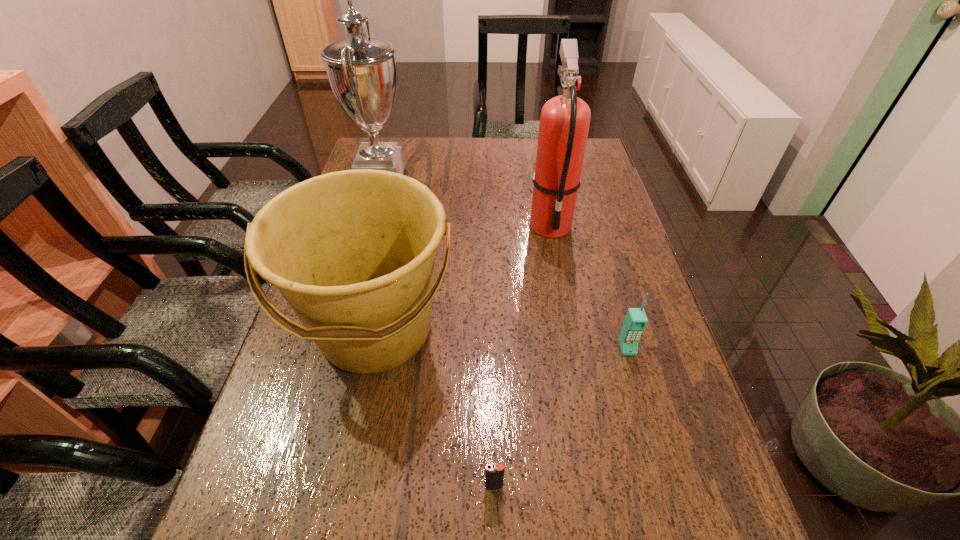
Where is `trophy cup`? Image resolution: width=960 pixels, height=540 pixels. trophy cup is located at coordinates (361, 70).

What are the coordinates of `fire extinguisher` in the screenshot? It's located at (564, 124).

Locate an element on the screen. the third shortest object is located at coordinates (353, 252).

You are a GUI agent. You are given a task and a screenshot of the screen. Output one action in this format:
    pyautogui.click(x=<x>, y=<y>)
    Task: Click on the rightmost object
    Image resolution: width=960 pixels, height=540 pixels.
    Given the screenshot: What is the action you would take?
    [x=636, y=320]

Where is `the second shortest object`? The image size is (960, 540). the second shortest object is located at coordinates (636, 320).

The height and width of the screenshot is (540, 960). What are the coordinates of `the third object from right to left` in the screenshot? It's located at tap(494, 473).

At what (x,y) coordinates should I click in order to perform the action: click on igniter. Please return your answer as a coordinate pair (x, y). Image resolution: width=960 pixels, height=540 pixels. Looking at the image, I should click on (494, 473).

Locate an element on the screen. The height and width of the screenshot is (540, 960). vacant space located 0.370m at the front view of the trophy cup is located at coordinates (529, 192).

Identify the location of vacant space located on the hose direction of the fourth object from left to right. The height and width of the screenshot is (540, 960). (575, 362).

The height and width of the screenshot is (540, 960). Find the location of `free space located 0.180m on the side of the bucket with the handle`. free space located 0.180m on the side of the bucket with the handle is located at coordinates (342, 495).